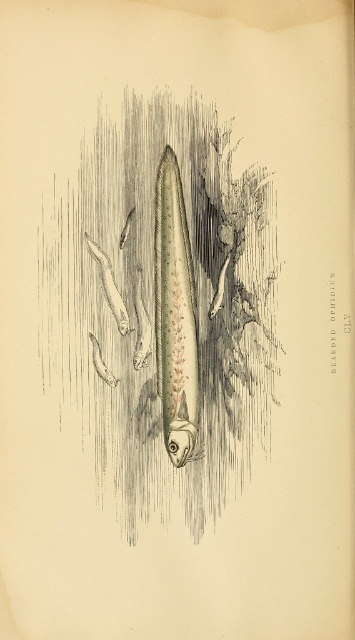
Question: Among these points, which one is nearest to the camera?

Choices:
 (A) (82, 380)
 (B) (166, 326)

Answer: (A)

Question: Is grayish-green textured fish at center positioned before shiny silver fish at center?

Choices:
 (A) yes
 (B) no

Answer: (A)

Question: Does grayish-green textured fish at center appear over shiny silver fish at center?

Choices:
 (A) no
 (B) yes

Answer: (A)

Question: Which of the following is the closest to the observer?

Choices:
 (A) (182, 202)
 (B) (122, 266)

Answer: (B)

Question: Among these points, which one is farthest from the camera?

Choices:
 (A) (188, 314)
 (B) (166, 99)

Answer: (A)

Question: Is grayish-green textured fish at center wider than shiny silver fish at center?

Choices:
 (A) no
 (B) yes

Answer: (B)